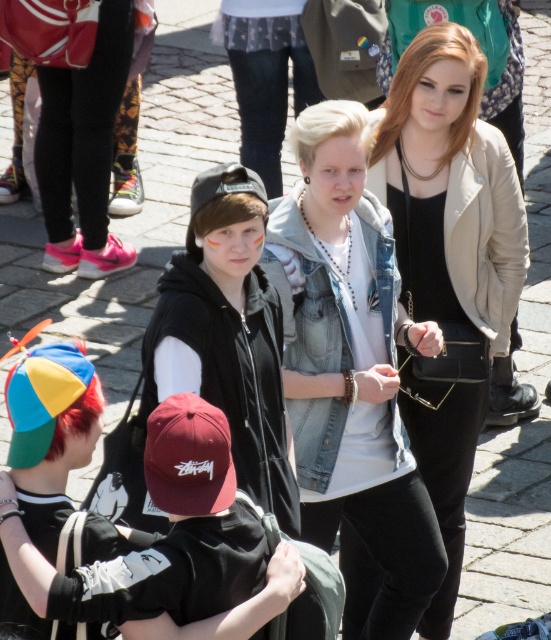
Is beige leather jacket at upper right shorter than matte black cap at center?

Incorrect, beige leather jacket at upper right's height does not fall short of matte black cap at center's.

Is beige leather jacket at upper right closer to camera compared to matte black cap at center?

No, beige leather jacket at upper right is behind matte black cap at center.

Which is behind, point (461, 81) or point (138, 627)?

The point (461, 81) is behind.

This screenshot has height=640, width=551. I want to click on beige leather jacket at upper right, so click(x=450, y=262).

Does point (364, 240) come in front of point (439, 170)?

Yes, it is in front of point (439, 170).

Does denim jacket at center appear over beige leather jacket at upper right?

Incorrect, denim jacket at center is not positioned above beige leather jacket at upper right.

This screenshot has height=640, width=551. What do you see at coordinates (349, 364) in the screenshot? I see `denim jacket at center` at bounding box center [349, 364].

Find the location of `denim jacket at center`. denim jacket at center is located at coordinates (349, 364).

Looking at this image, does denim jacket at center appear on the right side of black matte hoodie at center?

Correct, you'll find denim jacket at center to the right of black matte hoodie at center.

Which is in front, point (327, 250) or point (240, 384)?

Point (240, 384) is in front.

Is point (393, 387) positioned after point (245, 289)?

Yes, it is.

At what (x,y) coordinates should I click in order to perform the action: click on denim jacket at center. Please return your answer as a coordinate pair (x, y). The height and width of the screenshot is (640, 551). Looking at the image, I should click on (349, 364).